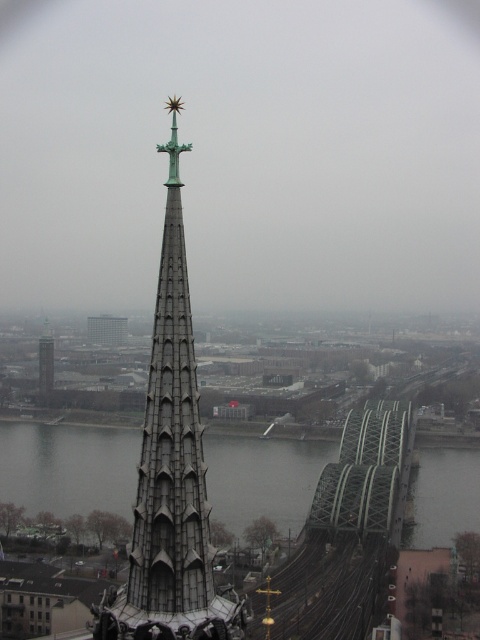
You are a tourist standing in front of the gray stone spire at center and the gray metallic water at lower center. Which object is closer to you?

The gray stone spire at center is closer to you because it is in front of the gray metallic water at lower center.

You are a tourist standing on the bridge and want to take a photo of the gray stone spire at center and the gray metallic water at lower center. Which object is positioned higher in the image?

The gray stone spire at center is located above the gray metallic water at lower center, so it is positioned higher in the image.

You are standing at the center of the bridge and want to take a photo of the gray stone spire at center. Based on its coordinates, in which direction should you point your camera to capture it?

The gray stone spire at center is located at point coordinates, so you should point your camera towards the center of the image to capture it.